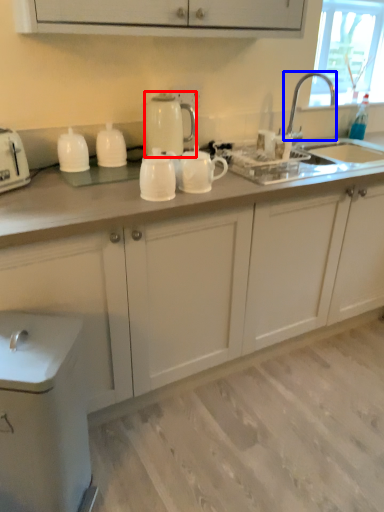
Question: Which of the following is the farthest to the observer, kitchen appliance (highlighted by a red box) or tap (highlighted by a blue box)?

Choices:
 (A) kitchen appliance
 (B) tap

Answer: (B)